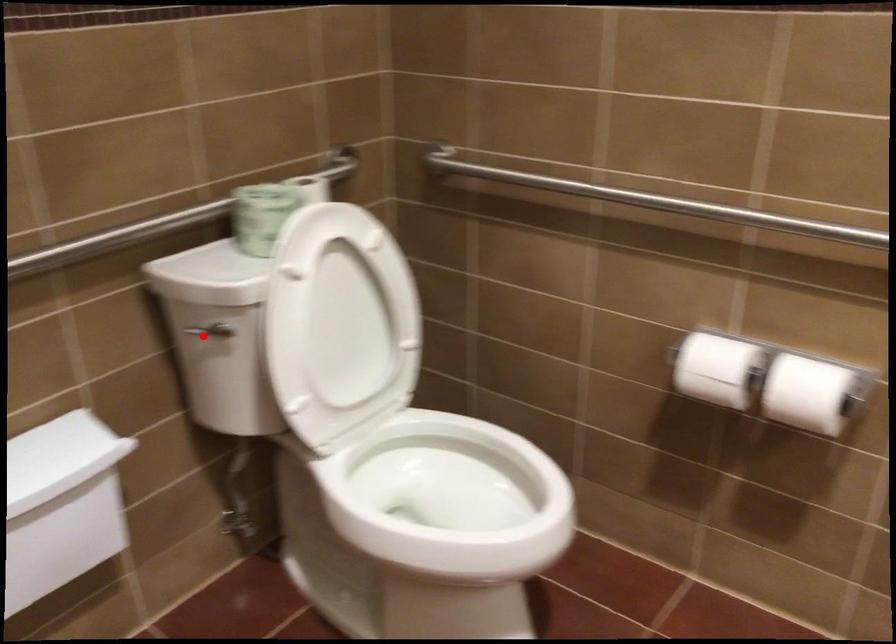
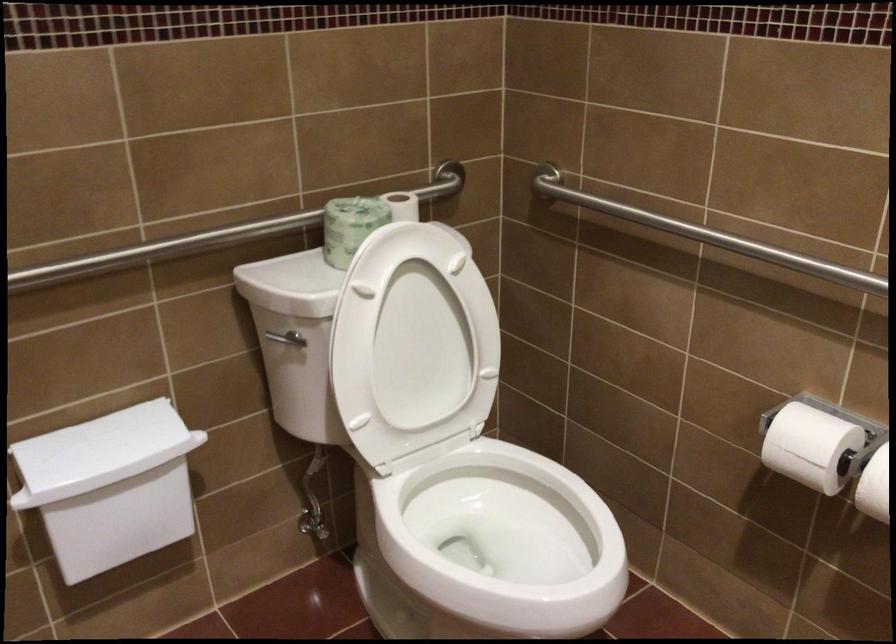
The point at the highlighted location is marked in the first image. Where is the corresponding point in the second image?

(281, 343)